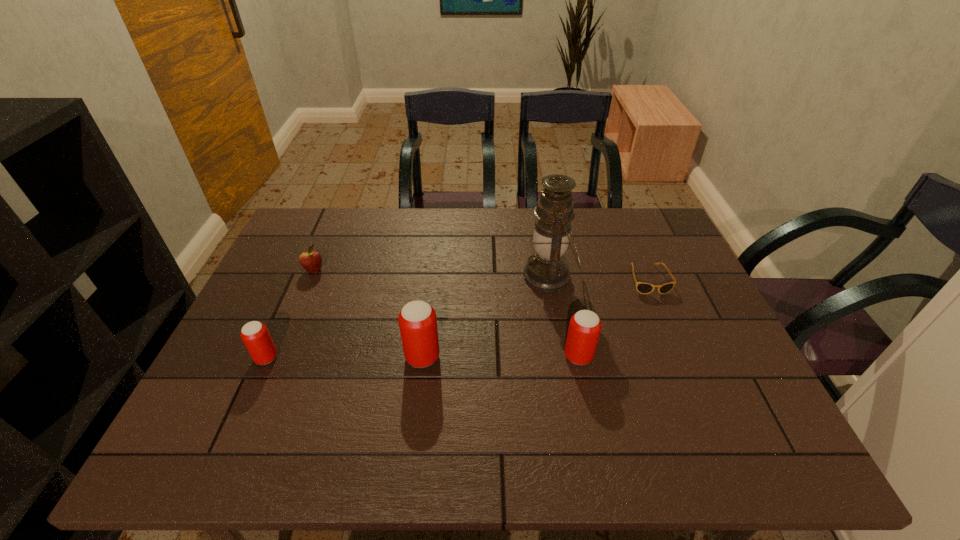
This screenshot has width=960, height=540. In order to click on the leftmost beer can in this screenshot , I will do `click(254, 334)`.

Locate an element on the screen. the fourth tallest object is located at coordinates (254, 334).

Find the location of a particular element. the second beer can from right to left is located at coordinates (417, 320).

The width and height of the screenshot is (960, 540). What are the coordinates of `the tallest beer can` in the screenshot? It's located at (417, 320).

Locate an element on the screen. This screenshot has height=540, width=960. the third tallest object is located at coordinates (584, 329).

Identify the location of the rightmost beer can. (584, 329).

This screenshot has height=540, width=960. Find the location of `sunglasses`. sunglasses is located at coordinates (644, 288).

What are the coordinates of `the rightmost object` in the screenshot? It's located at (644, 288).

At what (x,y) coordinates should I click in order to perform the action: click on apple. Please return your answer as a coordinate pair (x, y). This screenshot has width=960, height=540. Looking at the image, I should click on (311, 261).

At what (x,y) coordinates should I click in order to perform the action: click on oil lamp. Please return your answer as a coordinate pair (x, y). The width and height of the screenshot is (960, 540). Looking at the image, I should click on (547, 270).